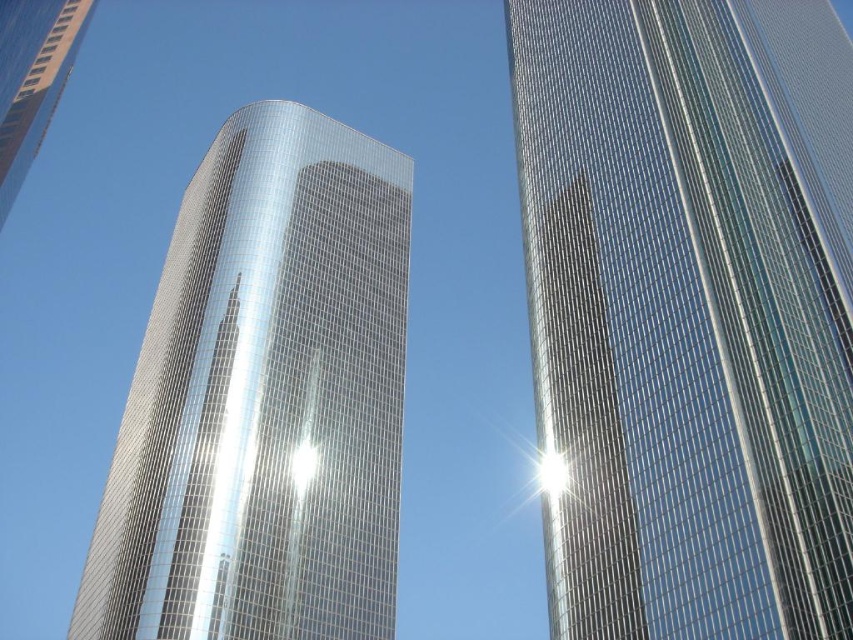
Question: Can you confirm if glossy glass skyscraper at center is positioned to the left of metallic glass tower at center?

Choices:
 (A) no
 (B) yes

Answer: (A)

Question: Is metallic glass tower at center smaller than polished glass skyscraper at upper left?

Choices:
 (A) no
 (B) yes

Answer: (B)

Question: Which point is farther to the camera?

Choices:
 (A) glossy glass skyscraper at center
 (B) metallic glass tower at center
 (C) glossy metallic tower at center
 (D) polished glass skyscraper at upper left

Answer: (C)

Question: Which of the following is the closest to the observer?

Choices:
 (A) (541, 394)
 (B) (759, 310)
 (C) (62, 84)

Answer: (B)

Question: Does metallic glass tower at center appear under polished glass skyscraper at upper left?

Choices:
 (A) no
 (B) yes

Answer: (B)

Question: Which point is closer to the camera?

Choices:
 (A) glossy glass skyscraper at center
 (B) metallic glass tower at center

Answer: (A)